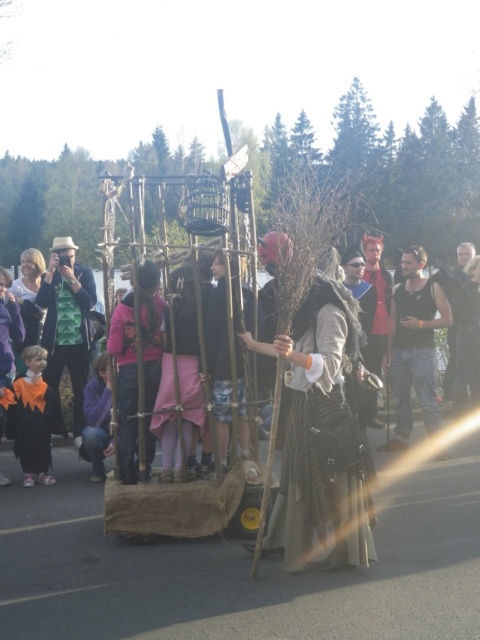
You are organizing a small event and need to decide which item to place first in your setup. You have the pink fabric at center and the purple fleece jacket at lower left. Based on their sizes, which one should you place first if you want to start with the smaller item?

The pink fabric at center has a smaller size compared to the purple fleece jacket at lower left, so you should place the pink fabric at center first.

You are a photographer at the event and want to capture a photo that includes both the pink fabric at center and the purple fleece jacket at lower left. Which object should you focus on first to ensure both are in the frame?

The pink fabric at center is in front of the purple fleece jacket at lower left, so you should focus on the purple fleece jacket at lower left first to ensure both are visible in the frame.